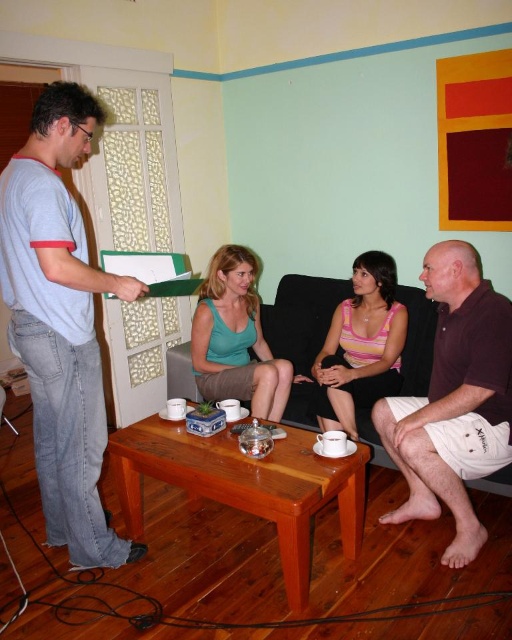
Does brown cotton shorts at lower right lie in front of pink striped dress at center?

Yes, brown cotton shorts at lower right is in front of pink striped dress at center.

Who is more distant from viewer, (474, 360) or (360, 296)?

Positioned behind is point (360, 296).

Where is `brown cotton shorts at lower right`? This screenshot has height=640, width=512. brown cotton shorts at lower right is located at coordinates (455, 401).

Where is `brown cotton shorts at lower right`? The height and width of the screenshot is (640, 512). brown cotton shorts at lower right is located at coordinates (455, 401).

Which is behind, point (121, 292) or point (218, 337)?

Point (218, 337)

Between light blue t-shirt at left and green matte tank top at center, which one appears on the right side from the viewer's perspective?

Positioned to the right is green matte tank top at center.

Measure the distance between light blue t-shirt at left and camera.

light blue t-shirt at left and camera are 6.07 feet apart.

Identify the location of light blue t-shirt at left. (60, 323).

Between point (226, 355) and point (389, 260), which one is positioned behind?

Positioned behind is point (226, 355).

Identify the location of green matte tank top at center. (236, 339).